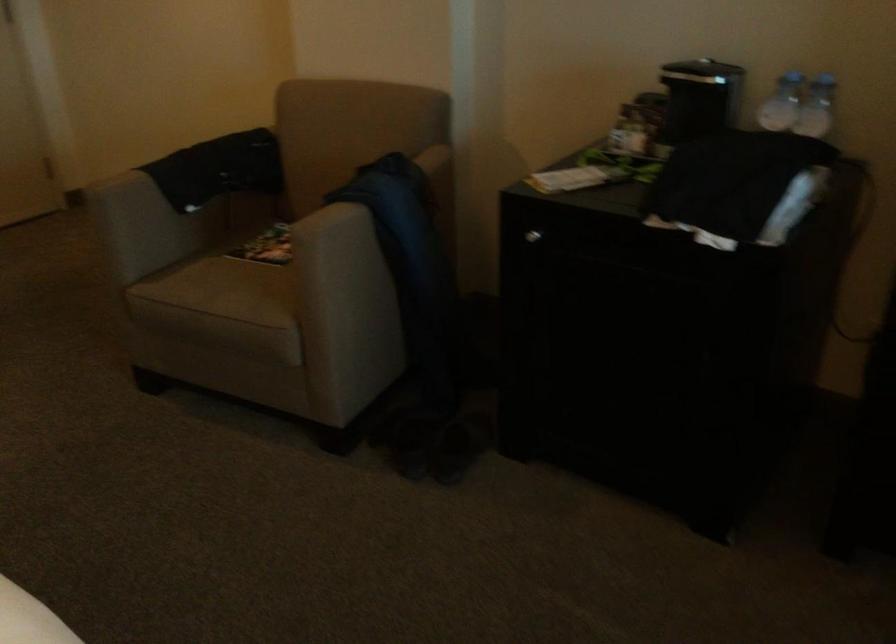
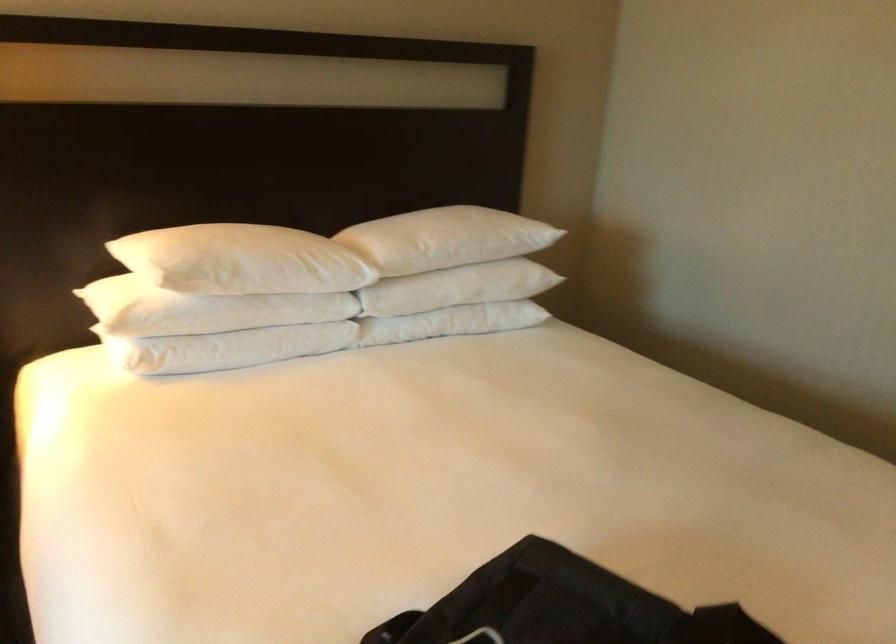
First-person continuous shooting, in which direction is the camera rotating?

The camera rotated toward left-down.